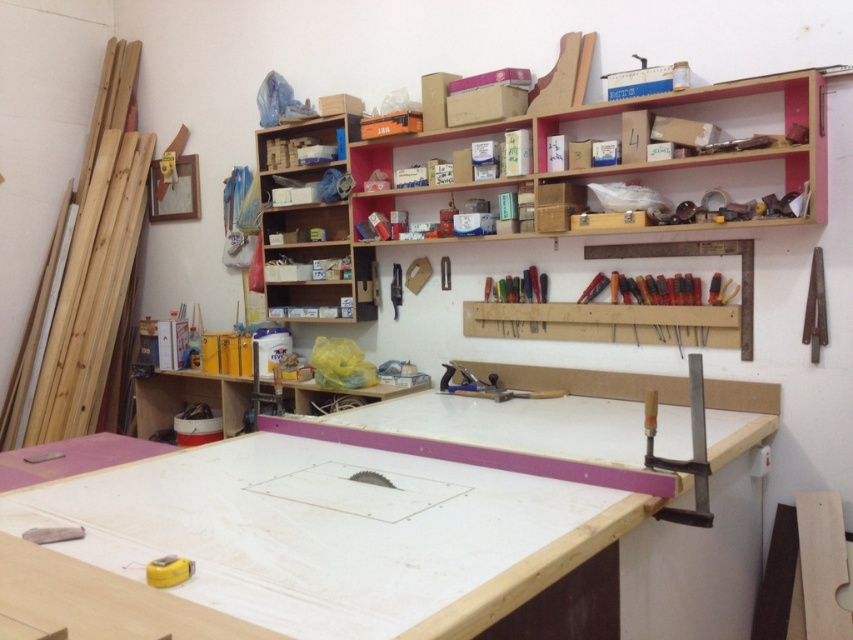
Question: Which object appears closest to the camera in this image?

Choices:
 (A) wooden shelves at upper center
 (B) metallic blue plane at center
 (C) metallic silver ruler at upper center

Answer: (B)

Question: Does metallic silver clamp at center lie behind metallic silver ruler at upper center?

Choices:
 (A) yes
 (B) no

Answer: (A)

Question: Can you confirm if metallic silver clamp at right is positioned below metallic silver clamp at center?

Choices:
 (A) no
 (B) yes

Answer: (B)

Question: Which point is farther to the camera?

Choices:
 (A) (531, 282)
 (B) (392, 294)
 (C) (442, 257)

Answer: (B)

Question: Based on their relative distances, which object is farther from the yellow plastic tape measure at lower left?

Choices:
 (A) metallic silver clamp at center
 (B) wooden ruler at right
 (C) metallic blue plane at center
 (D) multicolored plastic screwdriver set at center

Answer: (A)

Question: Is multicolored plastic screwdriver set at center to the left of metallic silver ruler at upper center from the viewer's perspective?

Choices:
 (A) no
 (B) yes

Answer: (A)